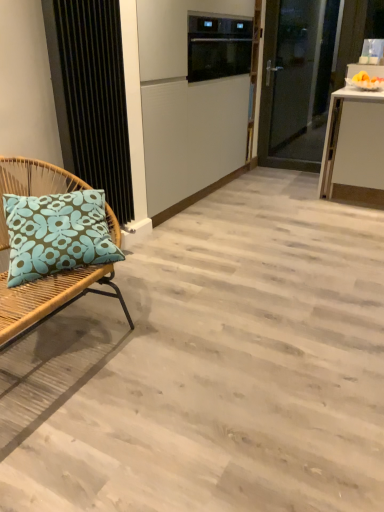
Question: From the image's perspective, is rattan cushion at left under black glass oven at upper center?

Choices:
 (A) yes
 (B) no

Answer: (A)

Question: Is rattan cushion at left outside black glass oven at upper center?

Choices:
 (A) no
 (B) yes

Answer: (B)

Question: Does rattan cushion at left come in front of black glass oven at upper center?

Choices:
 (A) yes
 (B) no

Answer: (A)

Question: From the image's perspective, is rattan cushion at left on black glass oven at upper center?

Choices:
 (A) yes
 (B) no

Answer: (B)

Question: Does rattan cushion at left appear on the left side of black glass oven at upper center?

Choices:
 (A) no
 (B) yes

Answer: (B)

Question: Is rattan cushion at left behind black glass oven at upper center?

Choices:
 (A) yes
 (B) no

Answer: (B)

Question: Considering the relative sizes of black glass oven at upper center and black textured radiator at left in the image provided, is black glass oven at upper center taller than black textured radiator at left?

Choices:
 (A) yes
 (B) no

Answer: (B)

Question: Does black glass oven at upper center have a larger size compared to black textured radiator at left?

Choices:
 (A) yes
 (B) no

Answer: (A)

Question: From a real-world perspective, does black glass oven at upper center sit lower than black textured radiator at left?

Choices:
 (A) yes
 (B) no

Answer: (B)

Question: Is black glass oven at upper center at the left side of black textured radiator at left?

Choices:
 (A) no
 (B) yes

Answer: (A)

Question: Would you say black glass oven at upper center is a long distance from black textured radiator at left?

Choices:
 (A) no
 (B) yes

Answer: (B)

Question: Is black glass oven at upper center further to the viewer compared to black textured radiator at left?

Choices:
 (A) no
 (B) yes

Answer: (B)

Question: Considering the relative sizes of rattan cushion at left and black textured radiator at left in the image provided, is rattan cushion at left shorter than black textured radiator at left?

Choices:
 (A) no
 (B) yes

Answer: (B)